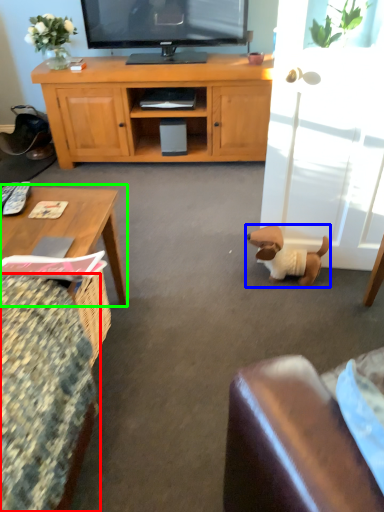
Question: Considering the real-world distances, which object is farthest from chair (highlighted by a red box)? dog (highlighted by a blue box) or coffee table (highlighted by a green box)?

Choices:
 (A) dog
 (B) coffee table

Answer: (A)